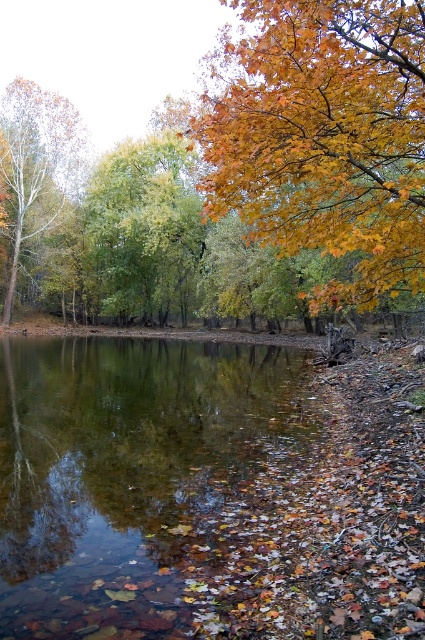
Question: Considering the relative positions of golden leafy tree at upper right and green leafy tree at center in the image provided, where is golden leafy tree at upper right located with respect to green leafy tree at center?

Choices:
 (A) right
 (B) left

Answer: (A)

Question: Is green leafy tree at center wider than smooth white bark tree at left?

Choices:
 (A) no
 (B) yes

Answer: (B)

Question: Estimate the real-world distances between objects in this image. Which object is closer to the clear water at center?

Choices:
 (A) golden leafy tree at upper right
 (B) smooth white bark tree at left

Answer: (A)

Question: Which point is farther to the camera?

Choices:
 (A) smooth white bark tree at left
 (B) golden leafy tree at upper right
 (C) green leafy tree at center

Answer: (A)

Question: Which of these objects is positioned closest to the clear water at center?

Choices:
 (A) green leafy tree at center
 (B) smooth white bark tree at left
 (C) golden leafy tree at upper right

Answer: (C)

Question: From the image, what is the correct spatial relationship of clear water at center in relation to golden leafy tree at upper right?

Choices:
 (A) right
 (B) left

Answer: (B)